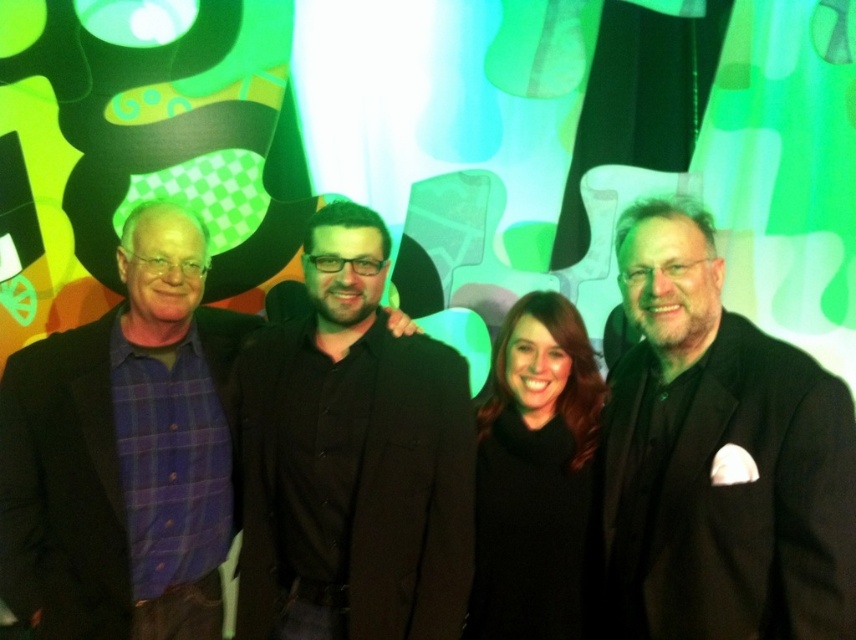
Is black pinstripe suit at right above black matte coat at center?

Yes, black pinstripe suit at right is above black matte coat at center.

Who is more forward, (617, 397) or (349, 403)?

Point (349, 403)

This screenshot has width=856, height=640. I want to click on black pinstripe suit at right, so click(x=717, y=458).

Between point (284, 506) and point (129, 408), which one is positioned behind?

The point (284, 506) is behind.

Between point (275, 561) and point (186, 403), which one is positioned in front?

Point (275, 561) is more forward.

The image size is (856, 640). What do you see at coordinates (351, 460) in the screenshot?
I see `black matte coat at center` at bounding box center [351, 460].

Find the location of `black matte coat at center`. black matte coat at center is located at coordinates (351, 460).

Can you confirm if purple plaid shirt at left is positioned to the left of black woolen sweater at center?

Correct, you'll find purple plaid shirt at left to the left of black woolen sweater at center.

This screenshot has height=640, width=856. Find the location of `purple plaid shirt at left`. purple plaid shirt at left is located at coordinates (122, 452).